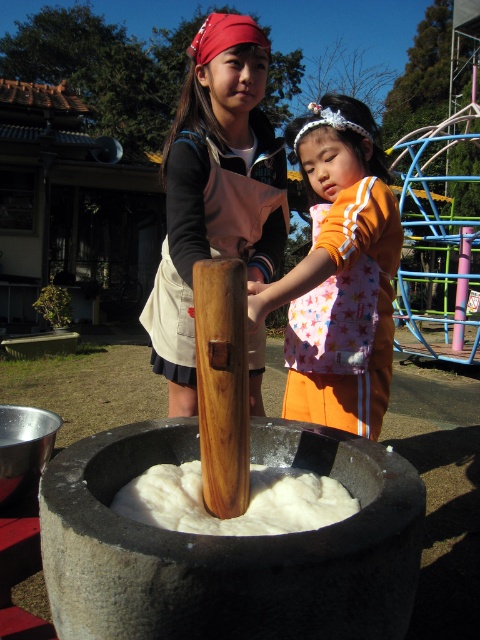
In the scene shown: What is the location of the white fluffy flour at center in the image?

The white fluffy flour at center is located at point (247, 508).

From the picture: You are standing at the center of the image. There is a point labeled at coordinates point [339,276]. What object is located at that point?

The point [339,276] corresponds to the orange fabric dress at center.

You are a photographer trying to capture a clear shot of the orange fabric dress at center and the white fluffy flour at center. Which object should you focus on first to ensure both are in focus?

The orange fabric dress at center is closer to you than the white fluffy flour at center, so focus on the orange fabric dress at center first to ensure both are in focus.